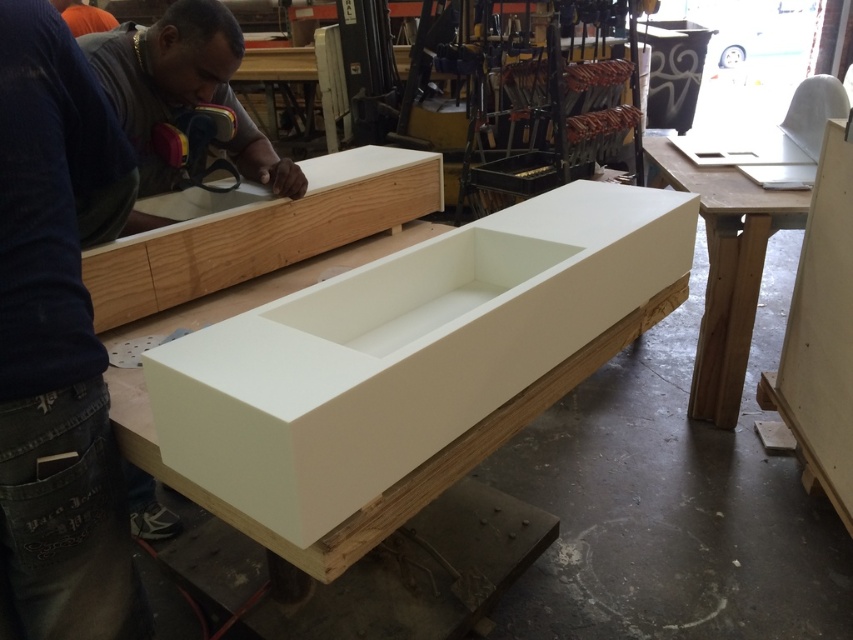
You are a carpenter working in the workshop and need to place a 1.2 meter tall sculpture on the white matte plywood at center or the white matte wood workbench at center. Which surface can safely support the sculpture based on their heights?

The white matte wood workbench at center is taller than the white matte plywood at center. Since the sculpture is 1.2 meters tall, it can be placed on the white matte wood workbench at center as it is tall enough to accommodate the sculpture without obstruction.

You are a workshop assistant who needs to place a 1.2 meter long tool on the natural wood plywood at center. Can you fit it on the plywood without overhanging the edges?

The natural wood plywood at center is 1.35 meters away from the viewer. The distance from the viewer does not indicate the size of the plywood. Therefore, it is unclear if the 1.2 meter long tool will fit without overhanging the edges.